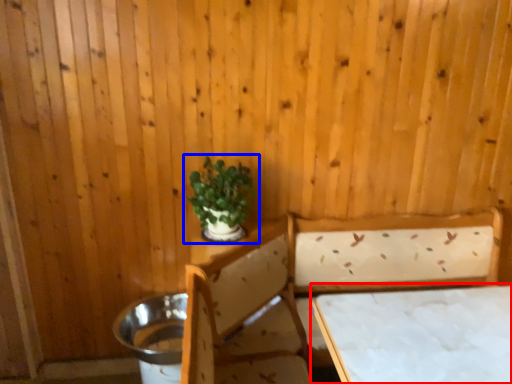
Question: Among these objects, which one is farthest to the camera, table (highlighted by a red box) or houseplant (highlighted by a blue box)?

Choices:
 (A) table
 (B) houseplant

Answer: (B)